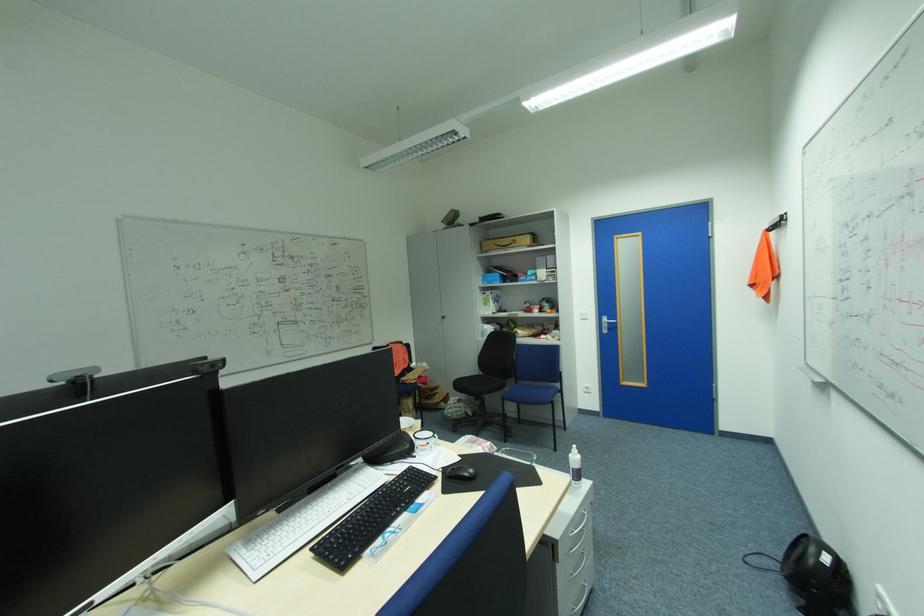
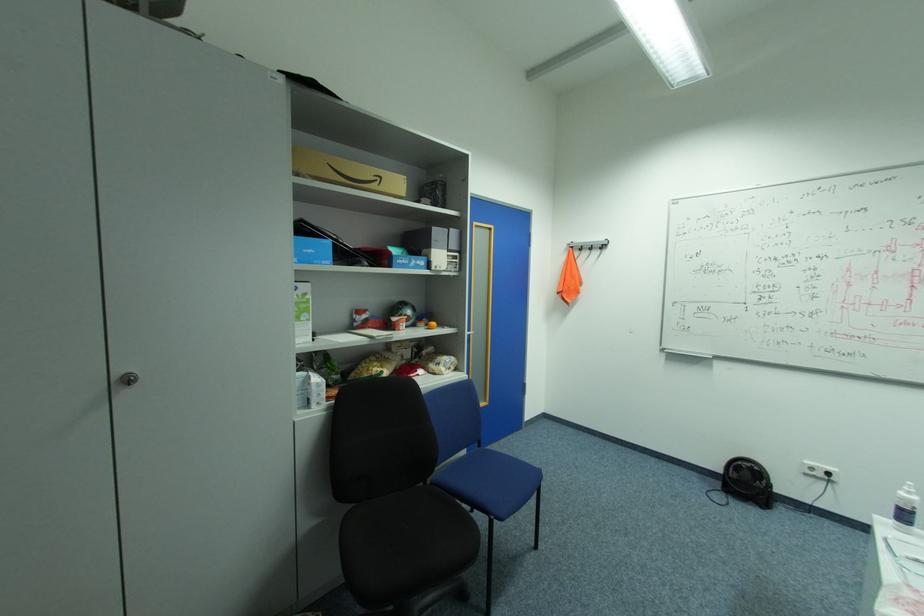
Where in the second image is the point corresponding to pixel 533 326 from the first image?

(380, 358)